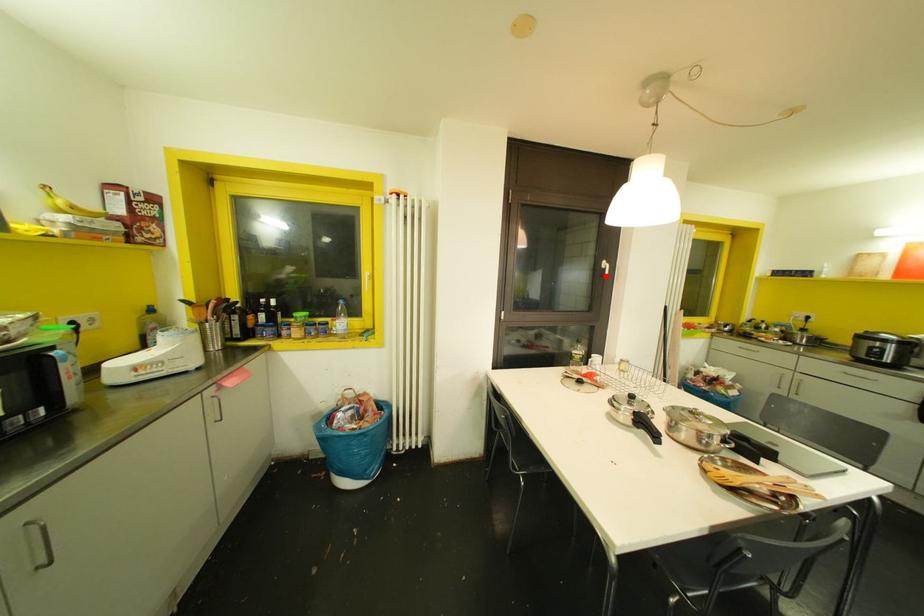
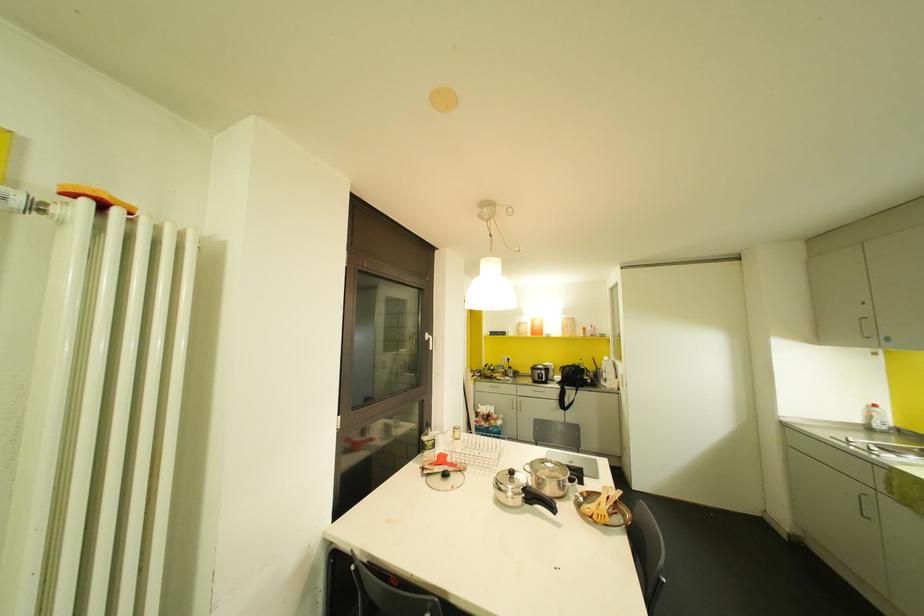
Question: A red point is marked in image1. In image2, is the corresponding 3D point closer to the camera or farther? Reply with the corresponding letter.

Choices:
 (A) The corresponding 3D point is closer.
 (B) The corresponding 3D point is farther.

Answer: (B)